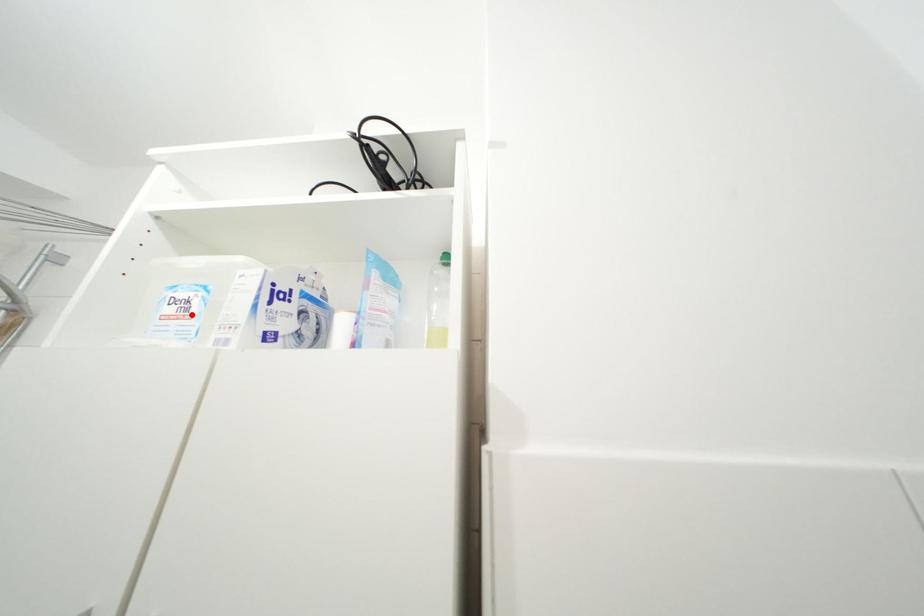
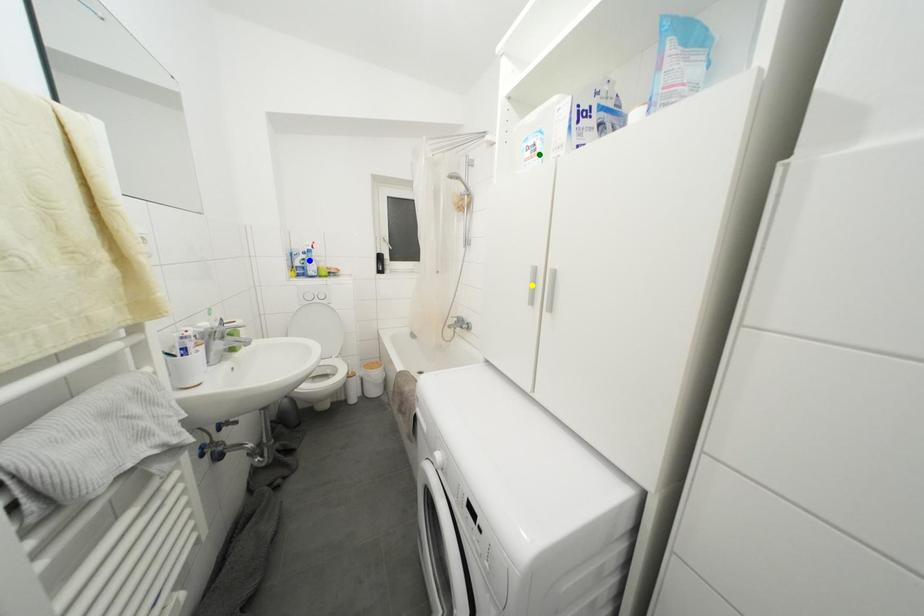
Question: I am providing you with two images of the same scene from different viewpoints. A red point is marked on the first image. You are given multiple points on the second image. Which point in image 2 represents the same 3d spot as the red point in image 1?

Choices:
 (A) yellow point
 (B) blue point
 (C) green point

Answer: (C)